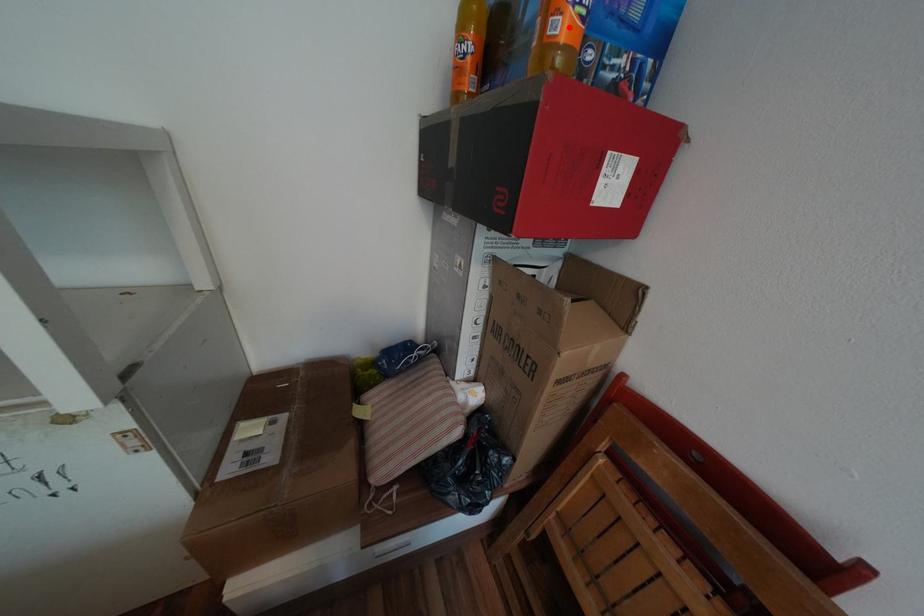
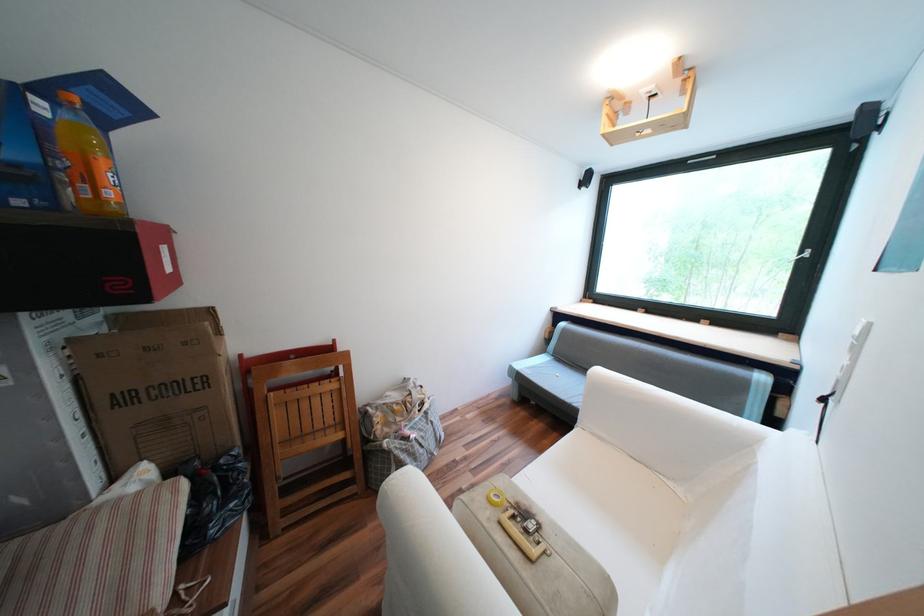
Locate, in the second image, the point that corresponds to the highlighted location in the first image.

(118, 193)